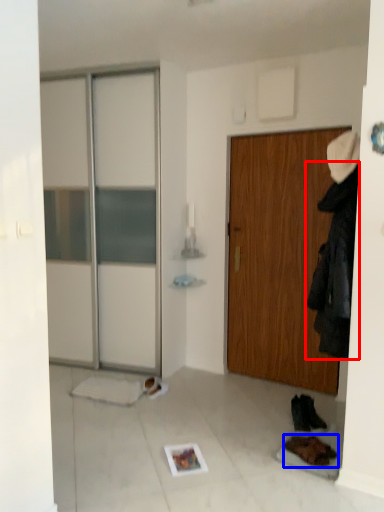
Question: Among these objects, which one is nearest to the camera, clothing (highlighted by a red box) or footwear (highlighted by a blue box)?

Choices:
 (A) clothing
 (B) footwear

Answer: (A)